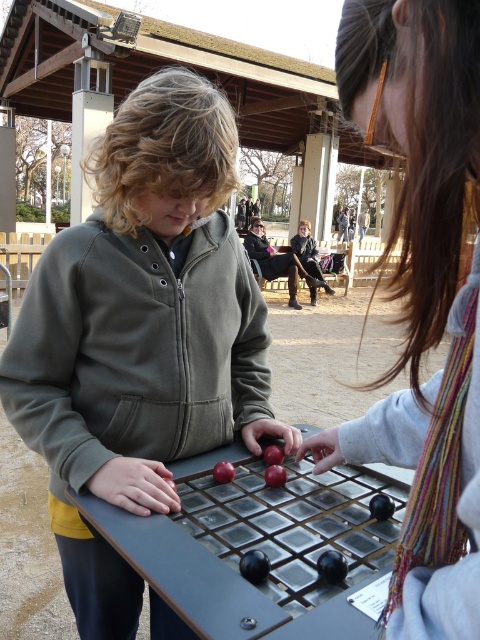
Can you confirm if matte green jacket at center is positioned below black leather jacket at center?

Correct, matte green jacket at center is located below black leather jacket at center.

This screenshot has width=480, height=640. What do you see at coordinates (141, 333) in the screenshot? I see `matte green jacket at center` at bounding box center [141, 333].

Locate an element on the screen. This screenshot has height=640, width=480. matte green jacket at center is located at coordinates (141, 333).

What do you see at coordinates (422, 298) in the screenshot? I see `multicolored scarf at center` at bounding box center [422, 298].

Can you confirm if multicolored scarf at center is positioned to the left of shiny black board game at center?

In fact, multicolored scarf at center is to the right of shiny black board game at center.

Which is in front, point (410, 385) or point (291, 513)?

Point (410, 385)

The width and height of the screenshot is (480, 640). Identify the location of multicolored scarf at center. (422, 298).

Who is higher up, matte green jacket at center or shiny black board game at center?

matte green jacket at center is above.

From the picture: Between matte green jacket at center and shiny black board game at center, which one appears on the right side from the viewer's perspective?

shiny black board game at center

Which is in front, point (164, 412) or point (229, 566)?

Positioned in front is point (229, 566).

Identify the location of matte green jacket at center. The width and height of the screenshot is (480, 640). (141, 333).